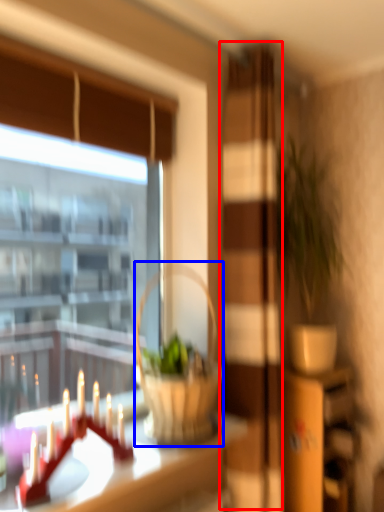
Question: Which of the following is the farthest to the observer, screen door (highlighted by a red box) or picnic basket (highlighted by a blue box)?

Choices:
 (A) screen door
 (B) picnic basket

Answer: (A)